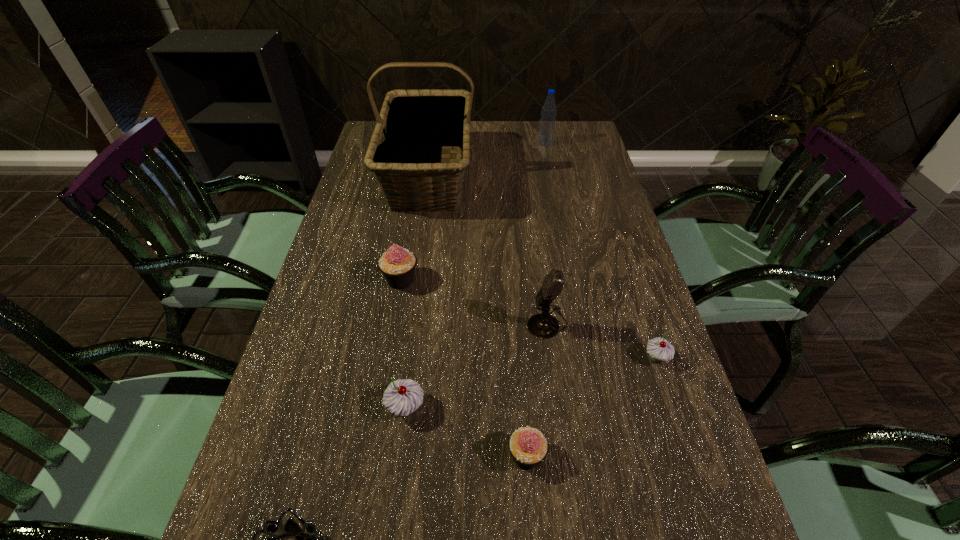
Identify the location of the third cupcake from left to right. The width and height of the screenshot is (960, 540). (528, 446).

Find the location of a particular element. the second nearest object is located at coordinates (528, 446).

Identify the location of free spot located 0.350m by the handle of the basket. Image resolution: width=960 pixels, height=540 pixels. tap(409, 314).

Find the location of `vacant region located 0.340m on the left of the water bottle`. vacant region located 0.340m on the left of the water bottle is located at coordinates (444, 143).

The image size is (960, 540). Find the location of `vacant region located on the front-facing side of the fourth farthest object`. vacant region located on the front-facing side of the fourth farthest object is located at coordinates (356, 323).

The width and height of the screenshot is (960, 540). I want to click on vacant space located 0.220m on the front-facing side of the fourth farthest object, so click(433, 323).

This screenshot has width=960, height=540. Find the location of `free space located on the front-facing side of the fourth farthest object`. free space located on the front-facing side of the fourth farthest object is located at coordinates (361, 323).

This screenshot has height=540, width=960. I want to click on vacant region located on the back of the third farthest cupcake, so click(x=421, y=281).

Image resolution: width=960 pixels, height=540 pixels. Identify the location of free location located on the front of the left pink cupcake. (389, 347).

At what (x,y) coordinates should I click in order to perform the action: click on vacant space situated on the left of the smaller gray cupcake. Please return your answer as a coordinate pair (x, y). This screenshot has height=540, width=960. Looking at the image, I should click on (547, 357).